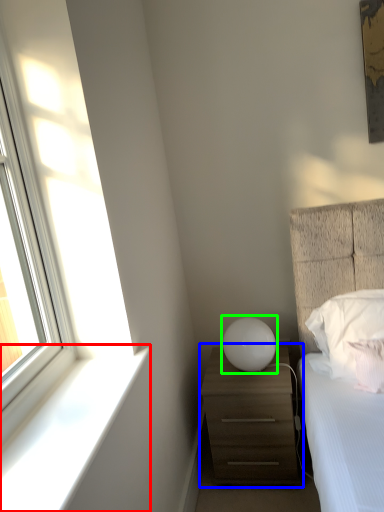
Question: Which object is the closest to the window sill (highlighted by a red box)? Choose among these: chest of drawers (highlighted by a blue box) or table lamp (highlighted by a green box).

Choices:
 (A) chest of drawers
 (B) table lamp

Answer: (A)